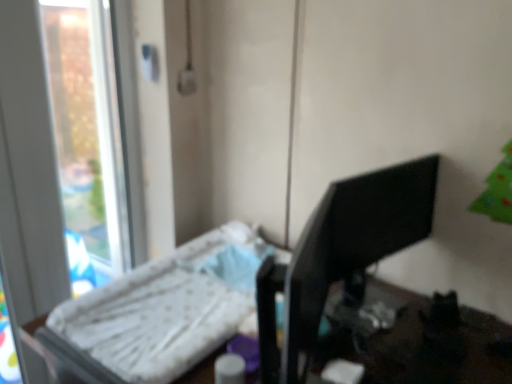
Question: Looking at the image, does black glossy monitor at right seem bigger or smaller compared to white fabric changing table at left?

Choices:
 (A) big
 (B) small

Answer: (B)

Question: Would you say black glossy monitor at right is to the left or to the right of white fabric changing table at left in the picture?

Choices:
 (A) right
 (B) left

Answer: (A)

Question: Considering the real-world distances, which object is closest to the white fabric changing table at left?

Choices:
 (A) black glossy monitor at right
 (B) transparent glass window at left

Answer: (A)

Question: Considering the real-world distances, which object is farthest from the black glossy monitor at right?

Choices:
 (A) white fabric changing table at left
 (B) transparent glass window at left

Answer: (B)